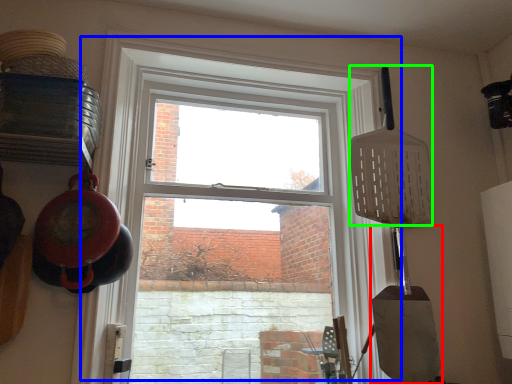
Question: Estimate the real-world distances between objects in this image. Which object is farther from shovel (highlighted by a red box), window (highlighted by a blue box) or spatula (highlighted by a green box)?

Choices:
 (A) window
 (B) spatula

Answer: (A)